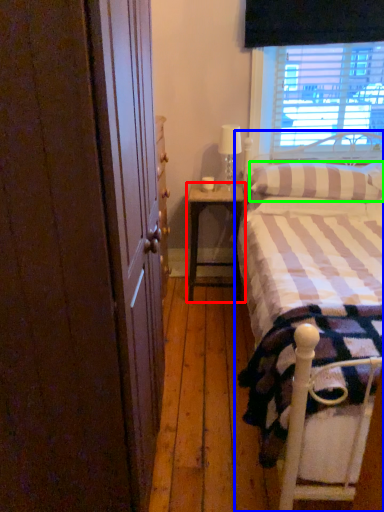
Question: Considering the real-world distances, which object is closest to nightstand (highlighted by a red box)? bed (highlighted by a blue box) or pillow (highlighted by a green box).

Choices:
 (A) bed
 (B) pillow

Answer: (B)